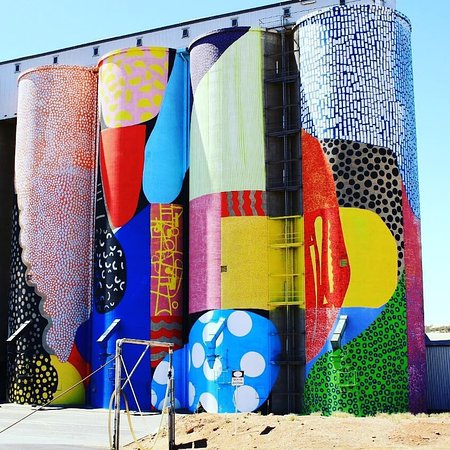
Identify the location of vents. This screenshot has width=450, height=450. (15, 67), (54, 60), (96, 50), (139, 42), (185, 33), (234, 21), (287, 12).